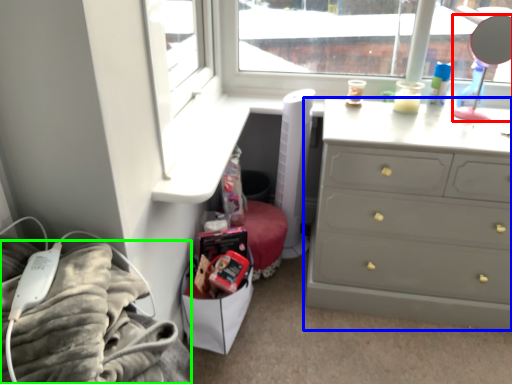
Question: Based on their relative distances, which object is nearer to mirror (highlighted by a red box)? Choose from chest of drawers (highlighted by a blue box) and bedding (highlighted by a green box).

Choices:
 (A) chest of drawers
 (B) bedding

Answer: (A)